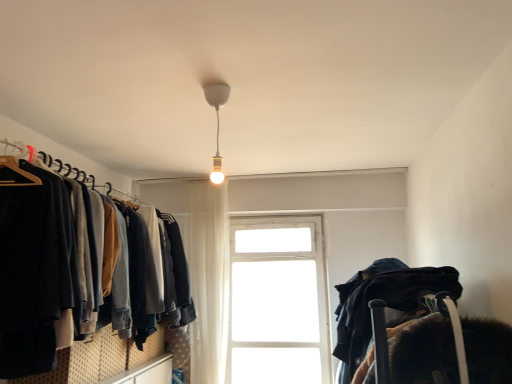
Question: Is dark blue sweater at left bigger or smaller than white matte bulb at center?

Choices:
 (A) small
 (B) big

Answer: (B)

Question: From a real-world perspective, is dark blue sweater at left above or below white matte bulb at center?

Choices:
 (A) above
 (B) below

Answer: (B)

Question: Which of these objects is positioned closest to the velvet dark blue blanket at right?

Choices:
 (A) dark blue sweater at left
 (B) white glass window at center
 (C) white sheer curtain at center
 (D) white matte bulb at center

Answer: (D)

Question: Which object is positioned farthest from the white matte bulb at center?

Choices:
 (A) white sheer curtain at center
 (B) dark blue sweater at left
 (C) white glass window at center
 (D) velvet dark blue blanket at right

Answer: (C)